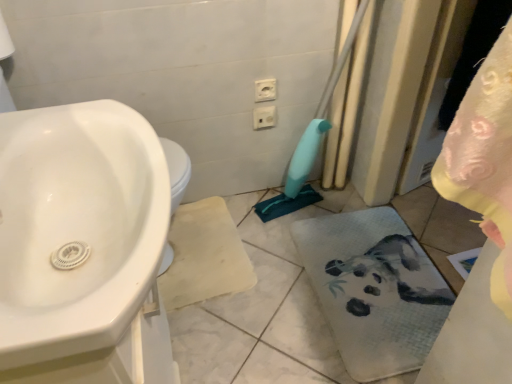
Find the location of a particular element. This screenshot has height=384, width=512. free space above white fabric bath towel at lower right (from a real-world perspective) is located at coordinates (379, 277).